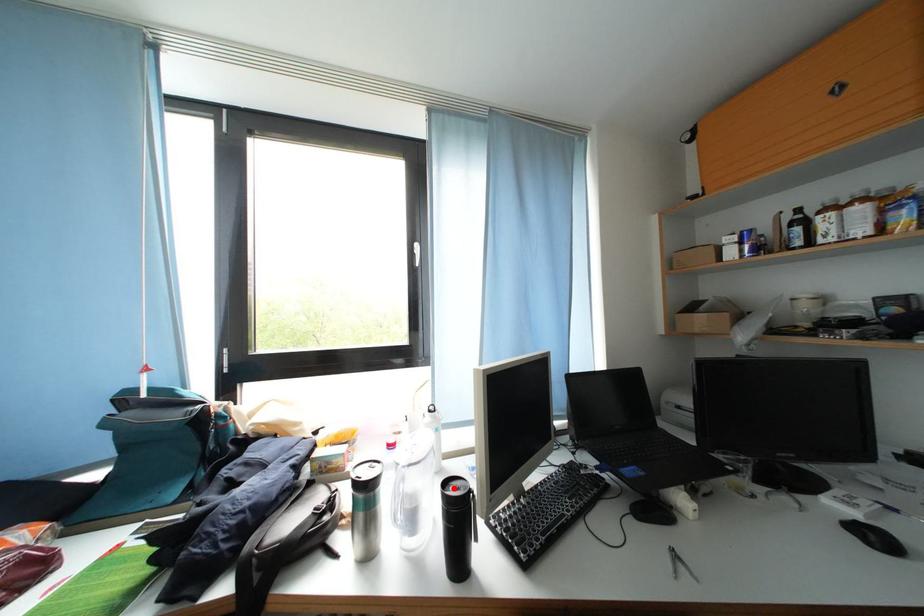
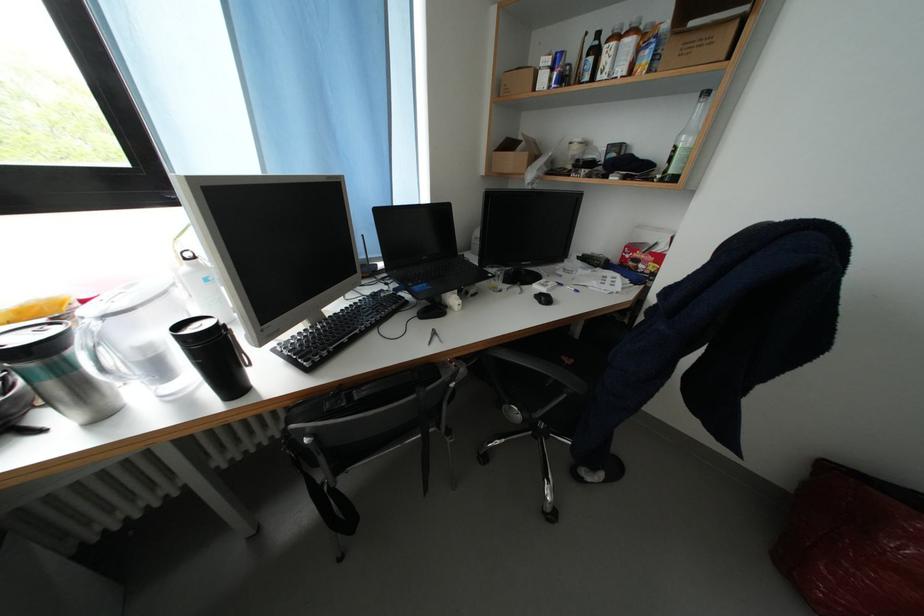
Locate, in the second image, the point that corresponds to the highlighted location in the first image.

(188, 330)